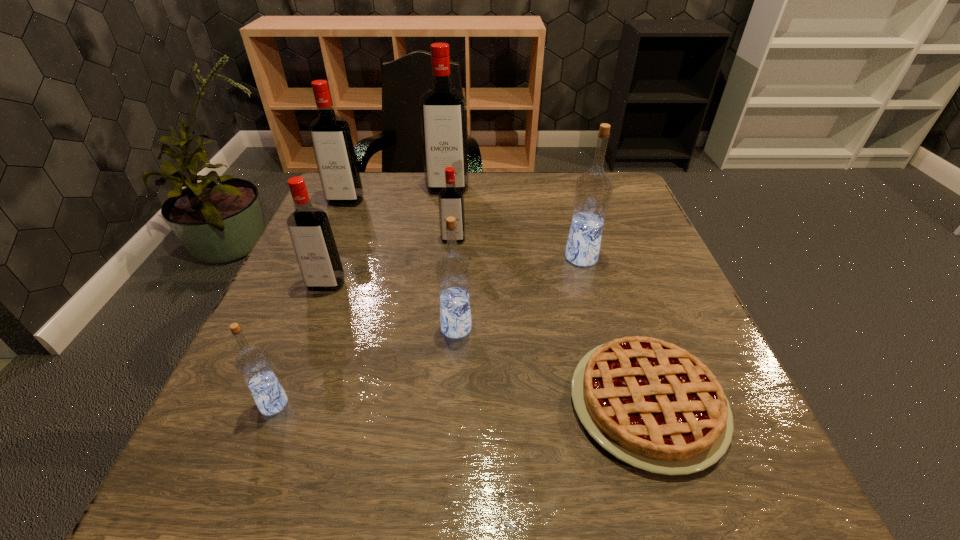
This screenshot has height=540, width=960. Find the location of `blank region between the nearest vodka and the third nearest object`. blank region between the nearest vodka and the third nearest object is located at coordinates (365, 366).

Where is `object that ranks as the closest to the tan pie`? This screenshot has width=960, height=540. object that ranks as the closest to the tan pie is located at coordinates (453, 271).

Locate an element on the screen. the sixth closest object to the smallest red vodka is located at coordinates (651, 404).

Locate an element on the screen. the fourth closest vodka to the fourth nearest object is located at coordinates (330, 134).

Identify which vodka is located as the fifth nearest to the biggest red vodka. Please provide its 2D coordinates. Your answer should be formatted as a tuple, i.e. [(x, y)], where the tuple contains the x and y coordinates of a point satisfying the conditions above.

[(453, 271)]

The width and height of the screenshot is (960, 540). I want to click on the second closest red vodka to the second nearest vodka, so click(450, 199).

Choose which red vodka is the second nearest neighbor to the tallest vodka. Please provide its 2D coordinates. Your answer should be formatted as a tuple, i.e. [(x, y)], where the tuple contains the x and y coordinates of a point satisfying the conditions above.

[(450, 199)]

Select which blue vodka is the second closest to the nearest red vodka. Please provide its 2D coordinates. Your answer should be formatted as a tuple, i.e. [(x, y)], where the tuple contains the x and y coordinates of a point satisfying the conditions above.

[(253, 364)]

Locate which blue vodka ranks second in proximity to the second smallest red vodka. Please provide its 2D coordinates. Your answer should be formatted as a tuple, i.e. [(x, y)], where the tuple contains the x and y coordinates of a point satisfying the conditions above.

[(253, 364)]

The image size is (960, 540). Find the location of `free location that satisfies the following two spatial constraints: 1. on the front and back of the second smallest red vodka; 2. on the left side of the pie`. free location that satisfies the following two spatial constraints: 1. on the front and back of the second smallest red vodka; 2. on the left side of the pie is located at coordinates (280, 403).